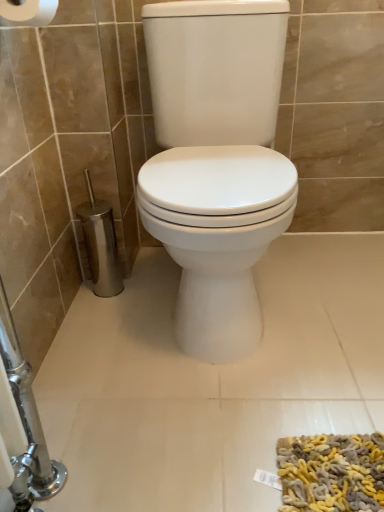
Locate an element on the screen. white matte toilet paper at upper left is located at coordinates (29, 11).

What do you see at coordinates (29, 11) in the screenshot?
I see `white matte toilet paper at upper left` at bounding box center [29, 11].

This screenshot has height=512, width=384. Find the location of `white matte toilet paper at upper left`. white matte toilet paper at upper left is located at coordinates (29, 11).